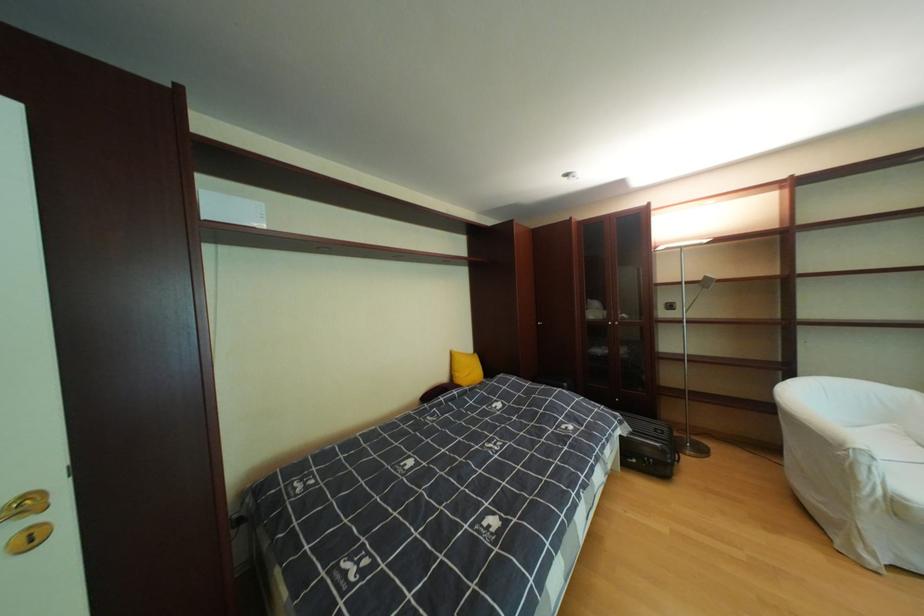
Find the location of a particular element. The image size is (924, 616). silver lamp head is located at coordinates (706, 283).